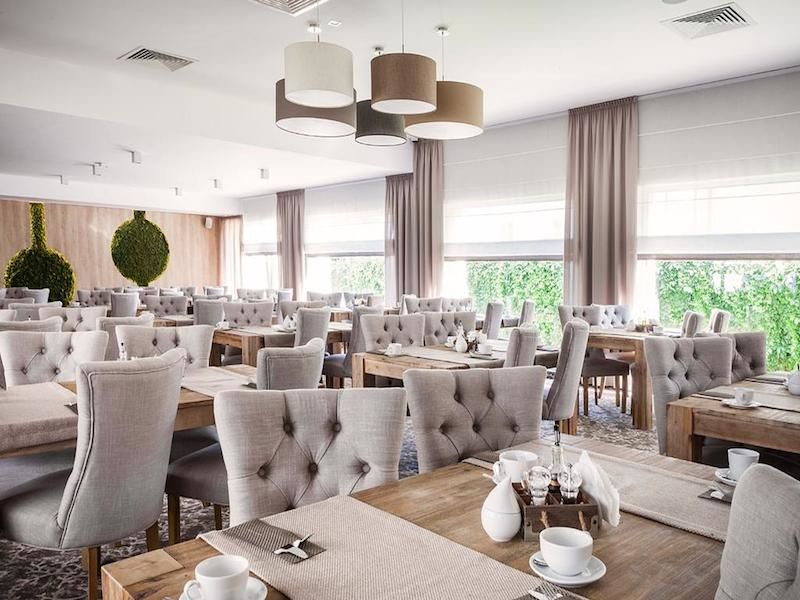
The height and width of the screenshot is (600, 800). In order to click on wooden table in this screenshot , I will do `click(458, 492)`, `click(712, 422)`, `click(629, 345)`, `click(416, 360)`, `click(237, 371)`, `click(241, 333)`, `click(170, 318)`, `click(342, 313)`.